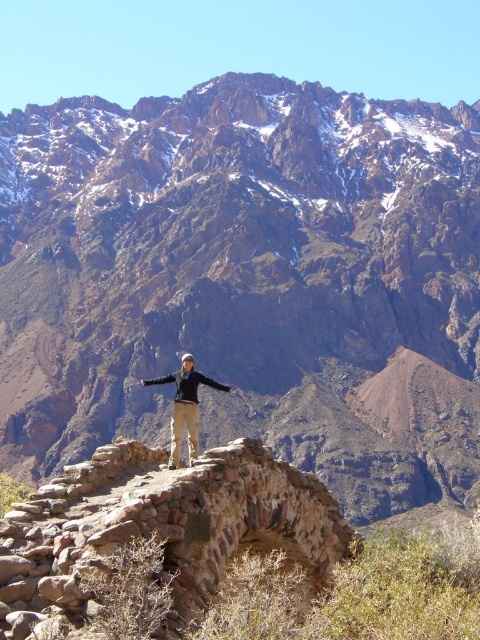
Question: Which object appears closest to the camera in this image?

Choices:
 (A) brown rocky mountain range at upper center
 (B) khaki pants at center

Answer: (B)

Question: Where is brown rocky mountain range at upper center located in relation to khaki pants at center in the image?

Choices:
 (A) left
 (B) right

Answer: (B)

Question: Which point is farther from the camera taking this photo?

Choices:
 (A) pyautogui.click(x=103, y=145)
 (B) pyautogui.click(x=170, y=460)

Answer: (A)

Question: Is brown rocky mountain range at upper center closer to camera compared to khaki pants at center?

Choices:
 (A) yes
 (B) no

Answer: (B)

Question: Is brown rocky mountain range at upper center in front of khaki pants at center?

Choices:
 (A) no
 (B) yes

Answer: (A)